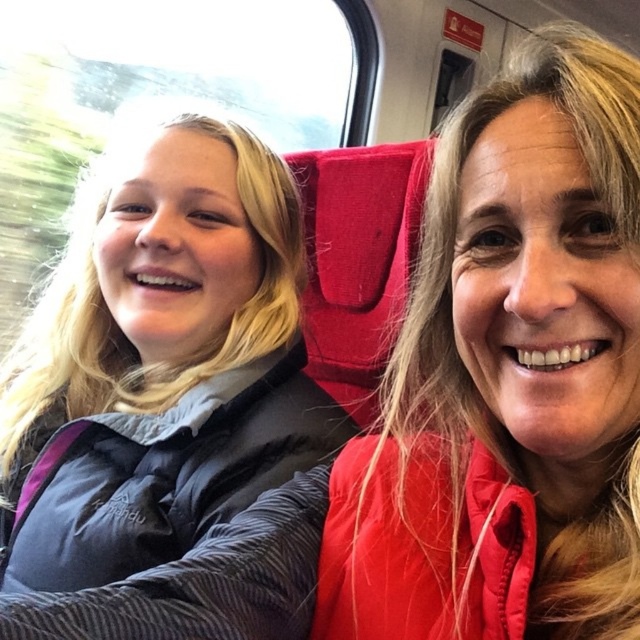
You are a photographer trying to capture a photo of the matte red jacket at right and the brushed nylon jacket at left. Since the jackets are overlapping, which jacket should you focus on to ensure the entire jacket is visible in the photo?

The matte red jacket at right is positioned over the brushed nylon jacket at left, so focusing on the matte red jacket at right will ensure the entire jacket is visible.

You are a passenger on a train and want to know where the red jacket at right is located relative to the point marked at coordinates (499, 378). Can you determine its position?

The red jacket at right is located exactly at the point marked at coordinates (499, 378).

You are a passenger on a train and want to place a small bag on the seat next to the matte red jacket at right. Based on the coordinates provided, where should you place the bag?

The matte red jacket at right is located at coordinates point (499, 378), so the bag should be placed near that position to be next to it.